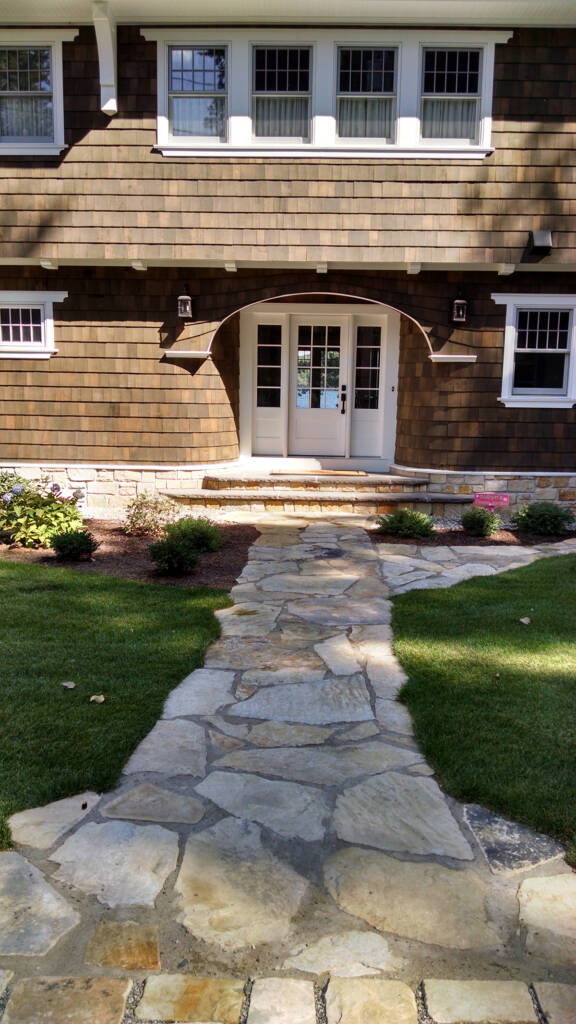
Find the location of a particular element. The image size is (576, 1024). windows is located at coordinates (34, 103), (209, 114), (262, 105), (375, 103), (450, 108), (537, 344), (26, 326).